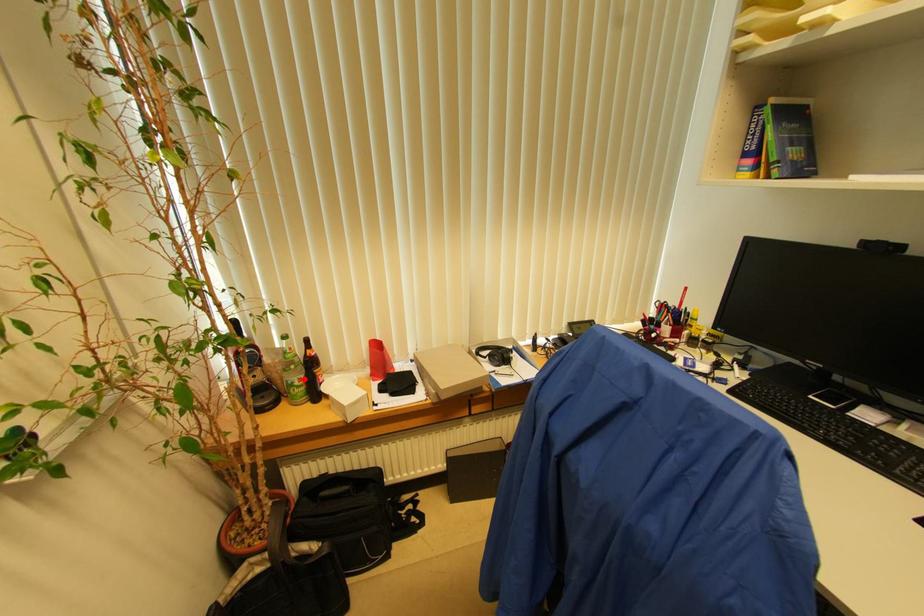
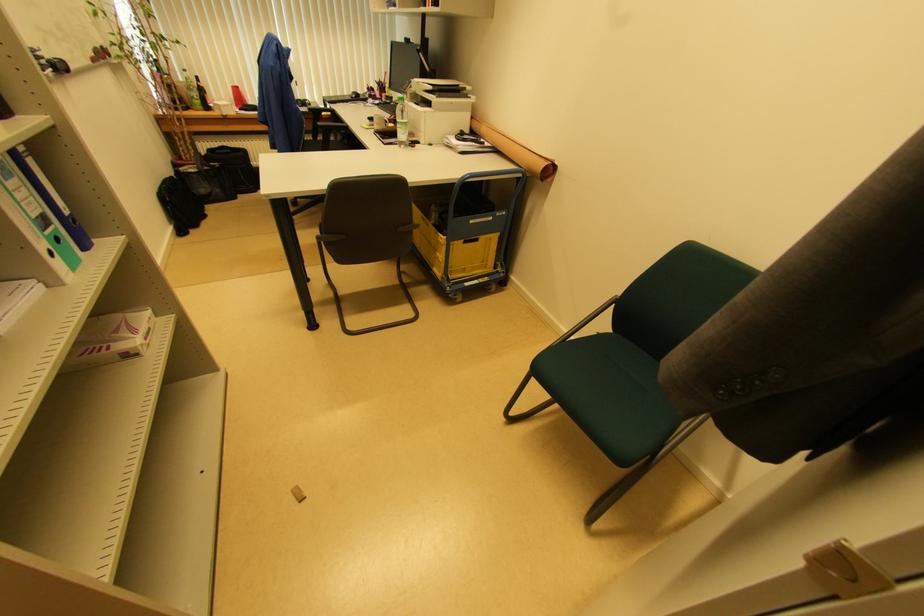
In the second image, find the point that corresponds to the highlighted location in the first image.

(200, 98)